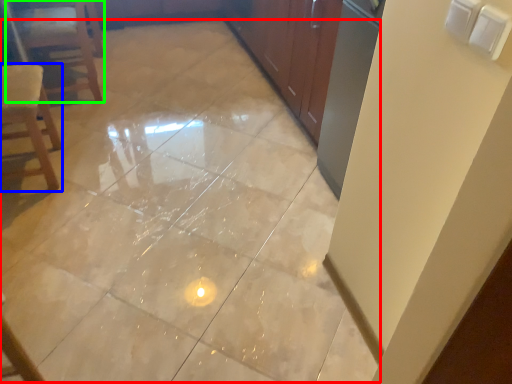
Question: Estimate the real-world distances between objects in this image. Which object is closer to ceramic tile (highlighted by a red box), chair (highlighted by a blue box) or furniture (highlighted by a green box)?

Choices:
 (A) chair
 (B) furniture

Answer: (A)